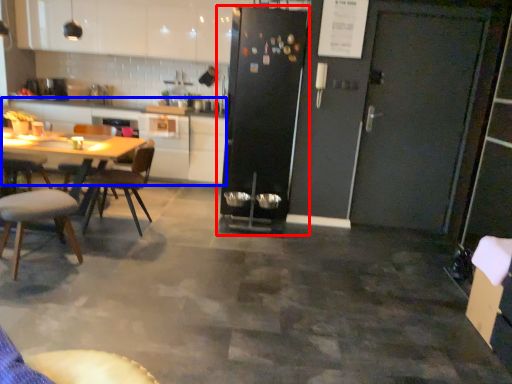
Question: Among these objects, which one is nearest to the camera, refrigerator (highlighted by a red box) or counter top (highlighted by a blue box)?

Choices:
 (A) refrigerator
 (B) counter top

Answer: (A)